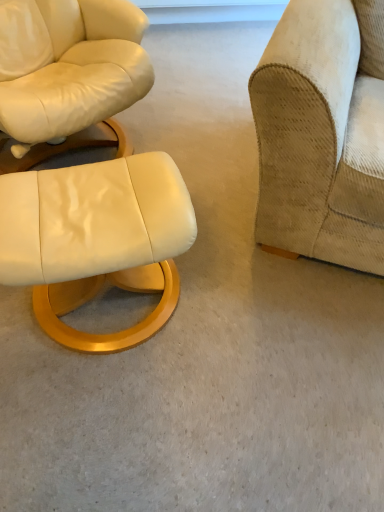
Identify the location of free space between beige corduroy couch at right and matte white leather ottoman at lower left. (239, 234).